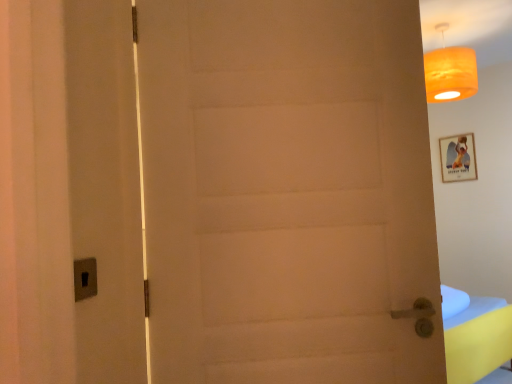
Question: Does white matte door at center appear on the right side of orange fabric lampshade at upper right?

Choices:
 (A) yes
 (B) no

Answer: (B)

Question: From the image's perspective, does white matte door at center appear higher than orange fabric lampshade at upper right?

Choices:
 (A) yes
 (B) no

Answer: (B)

Question: Is white matte door at center wider than orange fabric lampshade at upper right?

Choices:
 (A) yes
 (B) no

Answer: (B)

Question: Is the position of white matte door at center more distant than that of orange fabric lampshade at upper right?

Choices:
 (A) yes
 (B) no

Answer: (B)

Question: Could orange fabric lampshade at upper right be considered to be inside white matte door at center?

Choices:
 (A) no
 (B) yes

Answer: (A)

Question: Would you say orange fabric lampshade at upper right is inside or outside white matte door at center?

Choices:
 (A) outside
 (B) inside

Answer: (A)

Question: From the image's perspective, is orange fabric lampshade at upper right positioned above or below white matte door at center?

Choices:
 (A) below
 (B) above

Answer: (B)

Question: Based on their positions, is orange fabric lampshade at upper right located to the left or right of white matte door at center?

Choices:
 (A) left
 (B) right

Answer: (B)

Question: From a real-world perspective, is orange fabric lampshade at upper right positioned above or below white matte door at center?

Choices:
 (A) above
 (B) below

Answer: (A)

Question: Looking at their shapes, would you say white matte door at center is wider or thinner than wooden framed picture at upper right?

Choices:
 (A) thin
 (B) wide

Answer: (B)

Question: Considering the positions of white matte door at center and wooden framed picture at upper right in the image, is white matte door at center taller or shorter than wooden framed picture at upper right?

Choices:
 (A) tall
 (B) short

Answer: (A)

Question: From the image's perspective, is white matte door at center located above or below wooden framed picture at upper right?

Choices:
 (A) below
 (B) above

Answer: (A)

Question: Considering the positions of point (411, 337) and point (462, 147), is point (411, 337) closer or farther from the camera than point (462, 147)?

Choices:
 (A) farther
 (B) closer

Answer: (B)

Question: From the image's perspective, is white matte door at center above or below orange fabric lampshade at upper right?

Choices:
 (A) below
 (B) above

Answer: (A)

Question: Is point (366, 278) closer or farther from the camera than point (460, 97)?

Choices:
 (A) closer
 (B) farther

Answer: (A)